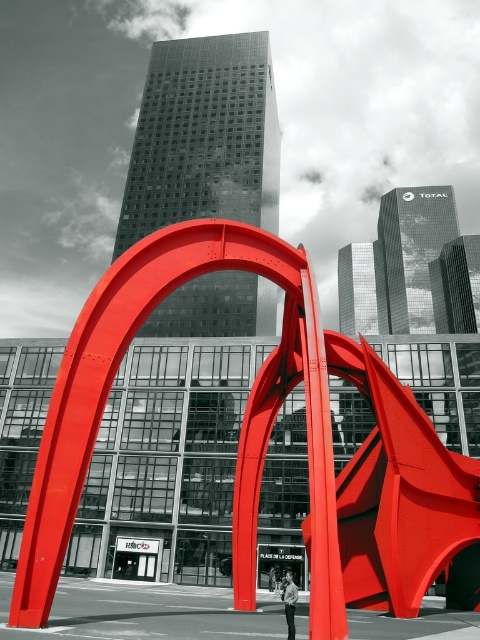
Does metallic red arch at center appear under light brown leather jacket at center?

Actually, metallic red arch at center is above light brown leather jacket at center.

Does metallic red arch at center have a lesser height compared to light brown leather jacket at center?

No.

Is point (319, 504) farther from camera compared to point (290, 632)?

Yes, it is.

The height and width of the screenshot is (640, 480). What are the coordinates of `metallic red arch at center` in the screenshot? It's located at (263, 440).